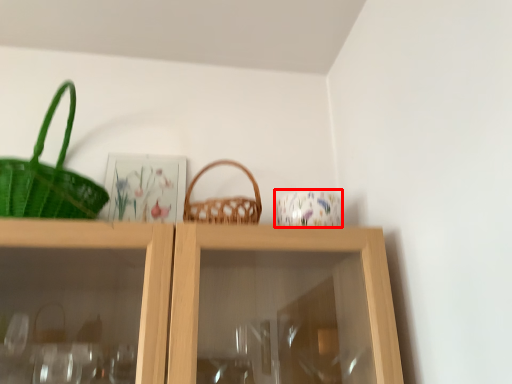
Question: From the image's perspective, what is the correct spatial relationship of tableware (annotated by the red box) in relation to picnic basket?

Choices:
 (A) above
 (B) below

Answer: (B)